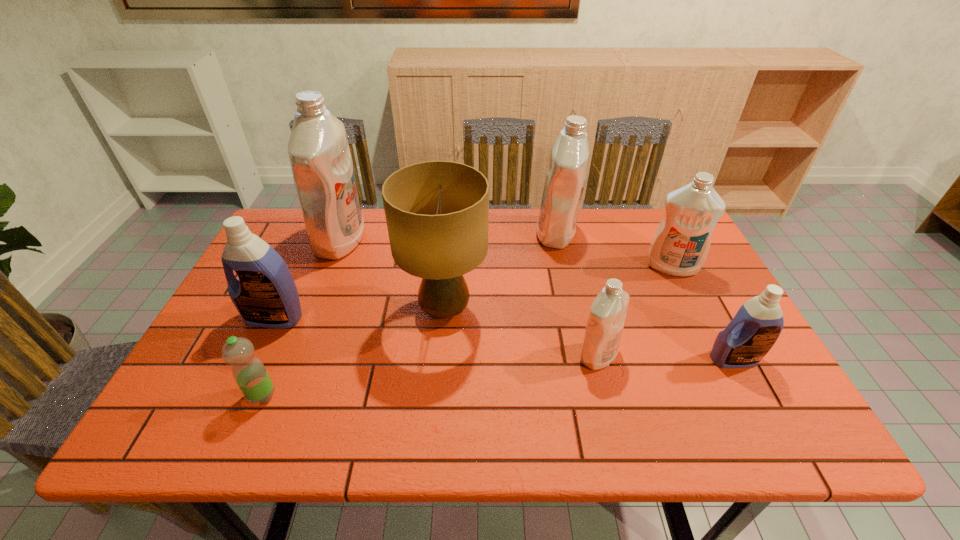
Image resolution: width=960 pixels, height=540 pixels. In order to click on the tallest object in this screenshot , I will do `click(318, 149)`.

The image size is (960, 540). What are the coordinates of `the leftmost white detergent` in the screenshot? It's located at (318, 149).

Locate an element on the screen. Image resolution: width=960 pixels, height=540 pixels. the third smallest white detergent is located at coordinates (565, 178).

You are a GUI agent. You are given a task and a screenshot of the screen. Output one action in this format:
    pyautogui.click(x=<x>, y=<y>)
    Task: Click on the lampshade
    The image size is (960, 540).
    Given the screenshot: What is the action you would take?
    pyautogui.click(x=437, y=212)

Locate an element on the screen. The image size is (960, 540). the fourth object from left to right is located at coordinates (437, 212).

I want to click on the rightmost white detergent, so click(680, 245).

At what (x,y) coordinates should I click in order to perform the action: click on the bigger blue detergent. Please return your answer as a coordinate pair (x, y). Looking at the image, I should click on (265, 295).

The height and width of the screenshot is (540, 960). What are the coordinates of `the farther blue detergent` in the screenshot? It's located at (265, 295).

Locate an element on the screen. This screenshot has height=540, width=960. the nearest white detergent is located at coordinates tap(608, 312).

The height and width of the screenshot is (540, 960). In order to click on the smaller blue detergent in this screenshot , I will do `click(755, 328)`.